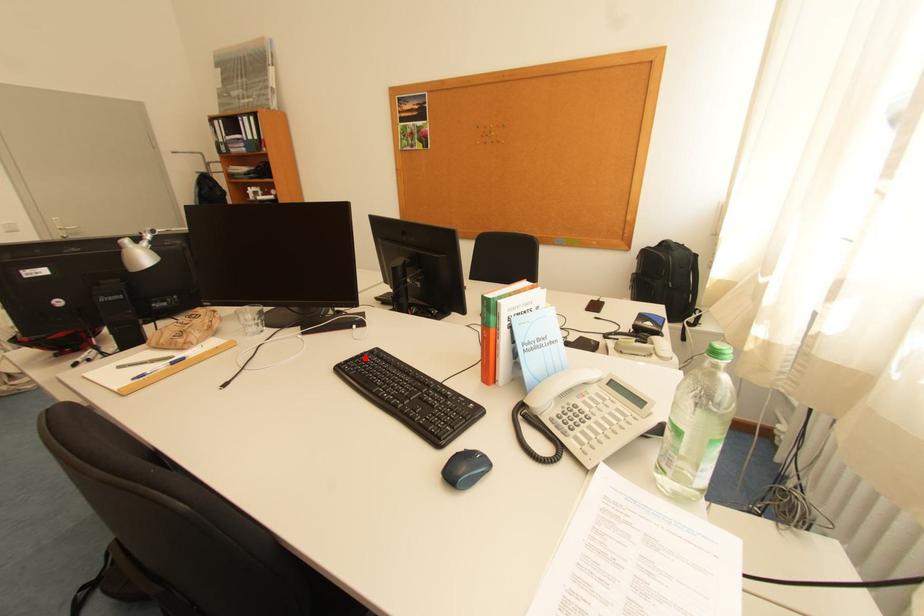
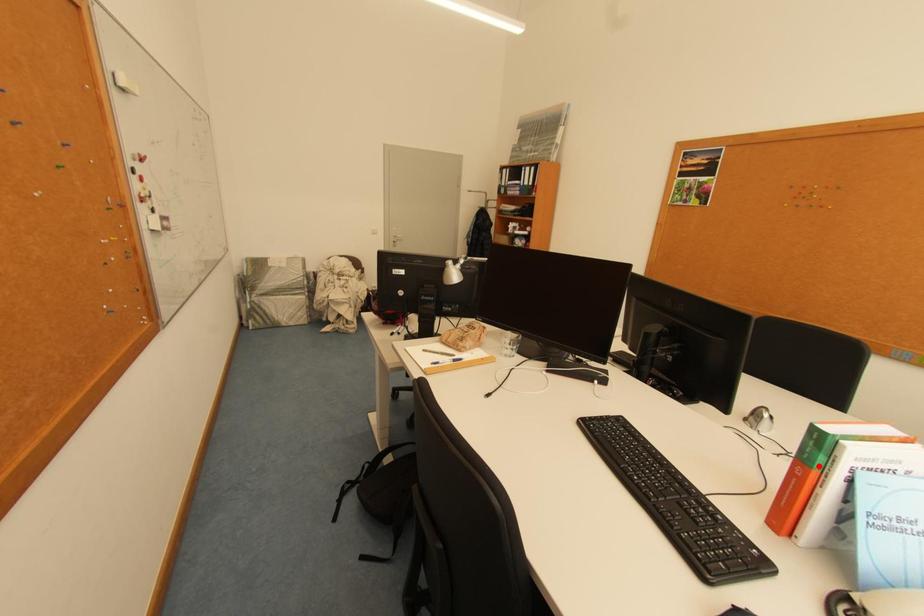
I am providing you with two images of the same scene from different viewpoints. A red point is marked on the first image and another point is marked on the second image. Are the points marked in image1 and image2 representing the same 3D position?

No